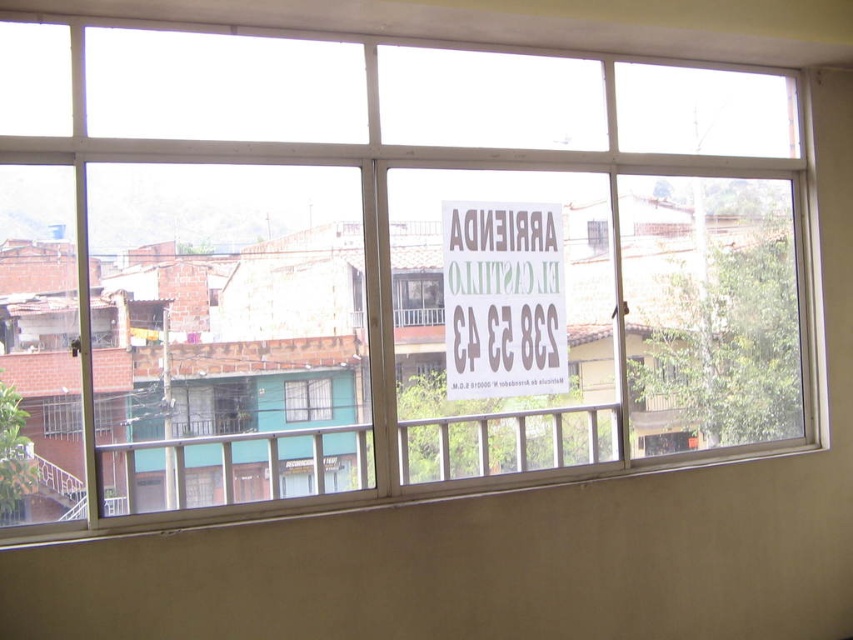
Question: Where is brown cardboard sign at center located in relation to clear glass window at center in the image?

Choices:
 (A) right
 (B) left

Answer: (A)

Question: Which point is farther from the camera taking this photo?

Choices:
 (A) (454, 232)
 (B) (283, 388)

Answer: (A)

Question: Can you confirm if brown cardboard sign at center is wider than clear glass window at center?

Choices:
 (A) no
 (B) yes

Answer: (B)

Question: Does brown cardboard sign at center lie behind clear glass window at center?

Choices:
 (A) yes
 (B) no

Answer: (A)